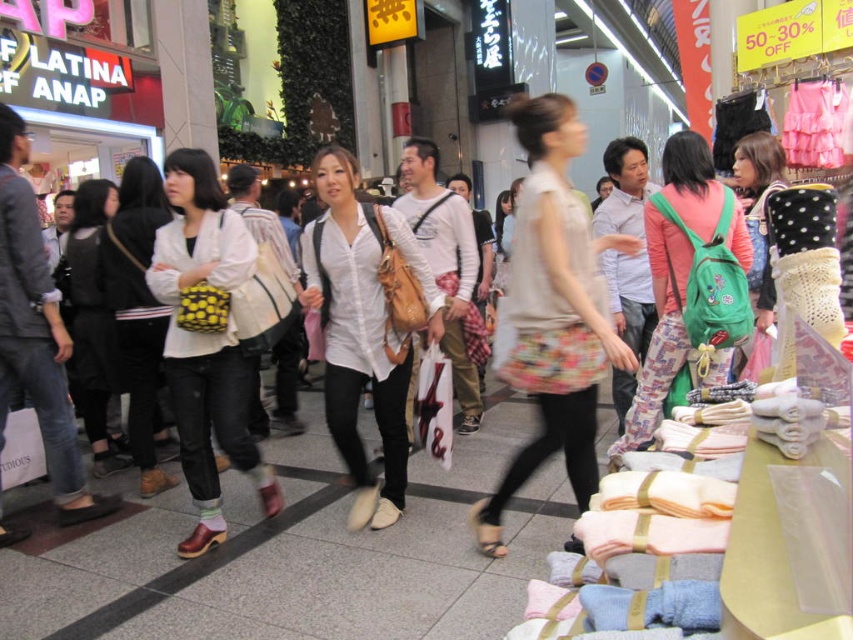
You are standing at the entrance of the store and see the green backpack at center. If you want to reach it, in which direction should you move relative to your current position?

The green backpack at center is located at point 0.436 on the x and 0.797 on the y axis. To reach it, you should move towards the center of the store from the entrance.

You are navigating through the shopping area and want to move from point A to point B. Point A is at coordinate point point (592, 422) and point B is at coordinate point (392, 225). Given that there are people moving around, can you safely walk from point A to point B without crossing paths with anyone?

Since point (592, 422) is in front of point (392, 225), you can safely walk from point A to point B without crossing paths with anyone as long as you maintain your direction.